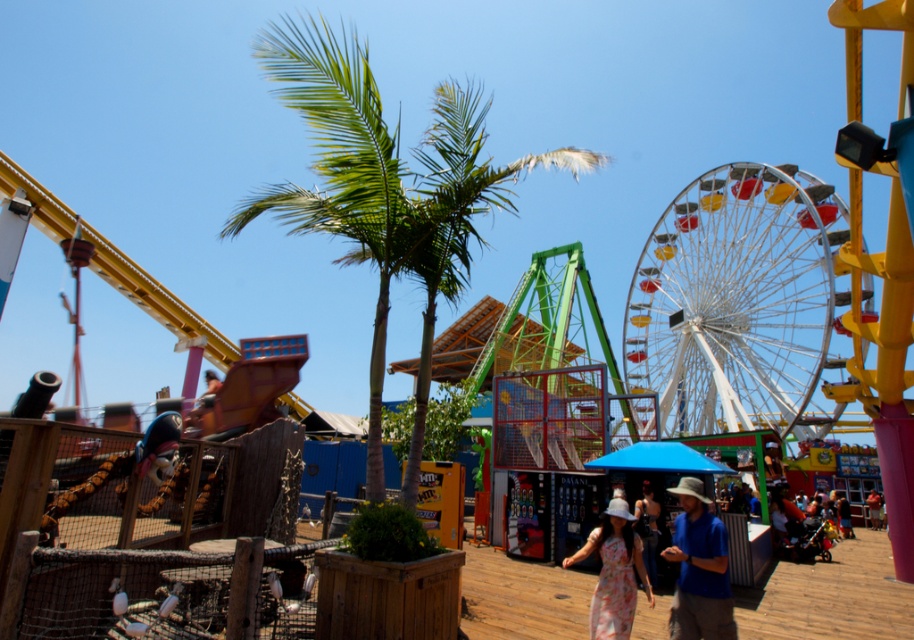
Is green leafy palm tree at center in front of blue cotton shirt at center?

No, it is not.

Is point (447, 116) positioned after point (708, 595)?

Yes, it is behind point (708, 595).

The image size is (914, 640). I want to click on green leafy palm tree at center, so click(x=385, y=188).

Which is below, blue cotton shirt at center or blue denim shorts at center?

Positioned lower is blue denim shorts at center.

Find the location of `blue cotton shirt at center`. blue cotton shirt at center is located at coordinates (699, 570).

Does metallic ferris wheel at right appear over green leafy palm tree at center?

Actually, metallic ferris wheel at right is below green leafy palm tree at center.

Is point (766, 348) farther from camera compared to point (412, 256)?

Yes, it is.

Where is `metallic ferris wheel at right`? The width and height of the screenshot is (914, 640). metallic ferris wheel at right is located at coordinates (735, 301).